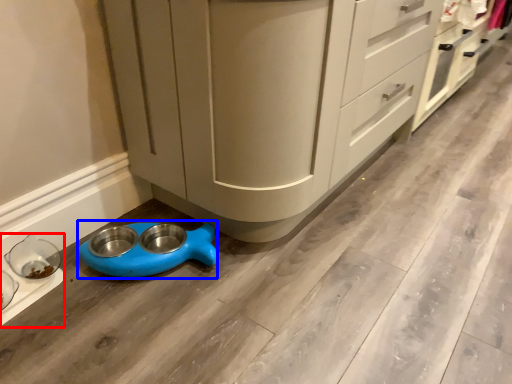
Question: Which object appears closest to the camera in this image, appliance (highlighted by a red box) or appliance (highlighted by a blue box)?

Choices:
 (A) appliance
 (B) appliance

Answer: (A)